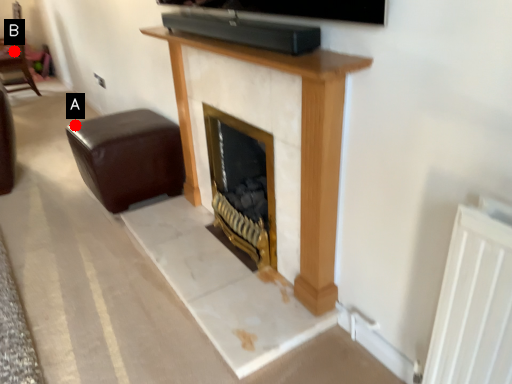
Question: Two points are circled on the image, labeled by A and B beside each circle. Which point is farther to the camera?

Choices:
 (A) A is further
 (B) B is further

Answer: (B)